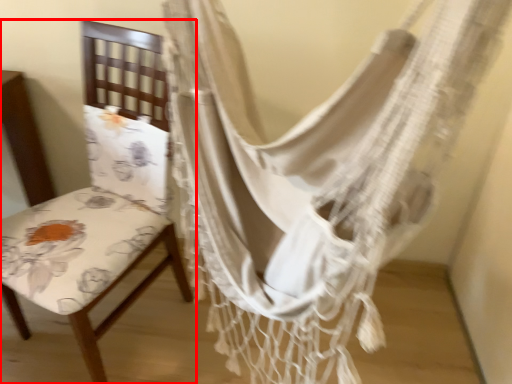
Question: From the image's perspective, what is the correct spatial positioning of chair (annotated by the red box) in reference to curtain?

Choices:
 (A) below
 (B) above

Answer: (A)